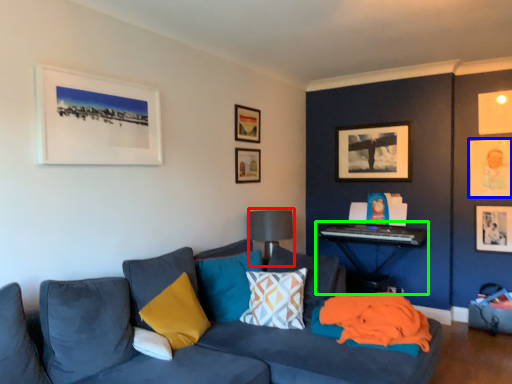
Question: Considering the real-world distances, which object is closest to lamp (highlighted by a red box)? picture frame (highlighted by a blue box) or table (highlighted by a green box).

Choices:
 (A) picture frame
 (B) table

Answer: (B)